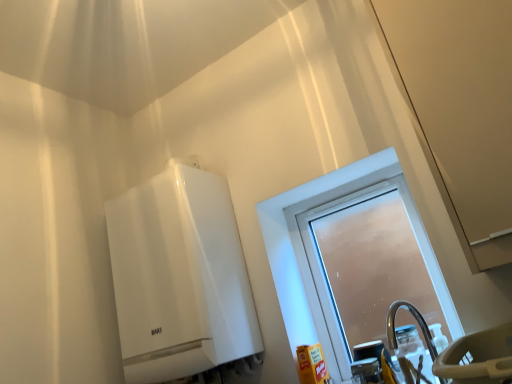
In order to click on transparent plastic screen door at upper right in this screenshot , I will do 461,108.

The image size is (512, 384). Describe the element at coordinates (461, 108) in the screenshot. I see `transparent plastic screen door at upper right` at that location.

Identify the location of white glossy water heater at upper left. Image resolution: width=512 pixels, height=384 pixels. (179, 277).

Is white glossy water heater at upper left bigger than frosted glass window at center?

Indeed, white glossy water heater at upper left has a larger size compared to frosted glass window at center.

Does point (229, 199) lie in front of point (340, 363)?

No, it is behind (340, 363).

In terms of height, does white glossy water heater at upper left look taller or shorter compared to frosted glass window at center?

Considering their sizes, white glossy water heater at upper left has more height than frosted glass window at center.

Considering the positions of objects white glossy water heater at upper left and frosted glass window at center in the image provided, who is behind, white glossy water heater at upper left or frosted glass window at center?

Positioned behind is frosted glass window at center.

Is transparent plastic screen door at upper right looking in the opposite direction of translucent plastic bottle at lower right?

No, transparent plastic screen door at upper right is not facing the opposite direction of translucent plastic bottle at lower right.

From a real-world perspective, is transparent plastic screen door at upper right under translucent plastic bottle at lower right?

No, from a real-world perspective, transparent plastic screen door at upper right is not under translucent plastic bottle at lower right.

Is point (465, 67) more distant than point (426, 362)?

No, (465, 67) is in front of (426, 362).

Would you say transparent plastic screen door at upper right is a long distance from translucent plastic bottle at lower right?

No, transparent plastic screen door at upper right is in close proximity to translucent plastic bottle at lower right.

Would you say frosted glass window at center contains translucent plastic bottle at lower right?

That's incorrect, translucent plastic bottle at lower right is not inside frosted glass window at center.

Considering the sizes of frosted glass window at center and translucent plastic bottle at lower right in the image, is frosted glass window at center wider or thinner than translucent plastic bottle at lower right?

Considering their sizes, frosted glass window at center looks slimmer than translucent plastic bottle at lower right.

Could you tell me if frosted glass window at center is facing translucent plastic bottle at lower right?

Yes, frosted glass window at center is facing translucent plastic bottle at lower right.

Does point (297, 243) appear closer or farther from the camera than point (423, 374)?

Point (297, 243) is positioned farther from the camera compared to point (423, 374).

Which is more to the left, transparent plastic screen door at upper right or frosted glass window at center?

From the viewer's perspective, frosted glass window at center appears more on the left side.

Considering the relative sizes of transparent plastic screen door at upper right and frosted glass window at center in the image provided, is transparent plastic screen door at upper right wider than frosted glass window at center?

Yes, transparent plastic screen door at upper right is wider than frosted glass window at center.

Considering the relative sizes of transparent plastic screen door at upper right and frosted glass window at center in the image provided, is transparent plastic screen door at upper right shorter than frosted glass window at center?

Incorrect, the height of transparent plastic screen door at upper right does not fall short of that of frosted glass window at center.

Is transparent plastic screen door at upper right in front of or behind frosted glass window at center in the image?

Visually, transparent plastic screen door at upper right is located in front of frosted glass window at center.

Is translucent plastic bottle at lower right surrounding frosted glass window at center?

No, frosted glass window at center is not surrounded by translucent plastic bottle at lower right.

From a real-world perspective, is translucent plastic bottle at lower right above or below frosted glass window at center?

In terms of real-world spatial position, translucent plastic bottle at lower right is below frosted glass window at center.

Considering the positions of objects translucent plastic bottle at lower right and frosted glass window at center in the image provided, who is in front, translucent plastic bottle at lower right or frosted glass window at center?

translucent plastic bottle at lower right.

Looking at this image, how many degrees apart are the facing directions of translucent plastic bottle at lower right and frosted glass window at center?

There is a 4.08-degree angle between the facing directions of translucent plastic bottle at lower right and frosted glass window at center.

Can you confirm if translucent plastic bottle at lower right is bigger than transparent plastic screen door at upper right?

No.

Can you tell me how much translucent plastic bottle at lower right and transparent plastic screen door at upper right differ in facing direction?

The facing directions of translucent plastic bottle at lower right and transparent plastic screen door at upper right are 4.46 degrees apart.

At what (x,y) coordinates should I click in order to perform the action: click on bottle below the transparent plastic screen door at upper right (from the image's perspective). Please return your answer as a coordinate pair (x, y). The width and height of the screenshot is (512, 384). Looking at the image, I should click on (413, 348).

Is translucent plastic bottle at lower right to the left of transparent plastic screen door at upper right from the viewer's perspective?

Yes.

Can you confirm if frosted glass window at center is positioned to the right of white glossy water heater at upper left?

Indeed, frosted glass window at center is positioned on the right side of white glossy water heater at upper left.

Based on their sizes in the image, would you say frosted glass window at center is bigger or smaller than white glossy water heater at upper left?

Clearly, frosted glass window at center is smaller in size than white glossy water heater at upper left.

Considering the relative positions of frosted glass window at center and white glossy water heater at upper left in the image provided, is frosted glass window at center in front of white glossy water heater at upper left?

No, frosted glass window at center is behind white glossy water heater at upper left.

Considering the positions of point (325, 324) and point (122, 227), is point (325, 324) closer or farther from the camera than point (122, 227)?

Point (325, 324) appears to be farther away from the viewer than point (122, 227).

Locate an element on the screen. The image size is (512, 384). window behind the white glossy water heater at upper left is located at coordinates (323, 270).

The height and width of the screenshot is (384, 512). Find the location of `screen door above the translucent plastic bottle at lower right (from the image's perspective)`. screen door above the translucent plastic bottle at lower right (from the image's perspective) is located at coordinates (461, 108).

From the image, which object appears to be farther from frosted glass window at center, transparent plastic screen door at upper right or white glossy water heater at upper left?

transparent plastic screen door at upper right is positioned further to the anchor frosted glass window at center.

Considering their positions, is white glossy water heater at upper left positioned closer to translucent plastic bottle at lower right than frosted glass window at center?

frosted glass window at center lies closer to translucent plastic bottle at lower right than the other object.

Which object lies further to the anchor point frosted glass window at center, translucent plastic bottle at lower right or transparent plastic screen door at upper right?

The object further to frosted glass window at center is transparent plastic screen door at upper right.

When comparing their distances from translucent plastic bottle at lower right, does transparent plastic screen door at upper right or white glossy water heater at upper left seem further?

transparent plastic screen door at upper right is positioned further to the anchor translucent plastic bottle at lower right.

Considering their positions, is translucent plastic bottle at lower right positioned further to white glossy water heater at upper left than frosted glass window at center?

translucent plastic bottle at lower right.

From the image, which object appears to be farther from frosted glass window at center, translucent plastic bottle at lower right or white glossy water heater at upper left?

white glossy water heater at upper left.

Based on their spatial positions, is frosted glass window at center or transparent plastic screen door at upper right closer to translucent plastic bottle at lower right?

frosted glass window at center is positioned closer to the anchor translucent plastic bottle at lower right.

Estimate the real-world distances between objects in this image. Which object is closer to transparent plastic screen door at upper right, translucent plastic bottle at lower right or white glossy water heater at upper left?

translucent plastic bottle at lower right is positioned closer to the anchor transparent plastic screen door at upper right.

Identify the location of window between transparent plastic screen door at upper right and translucent plastic bottle at lower right from top to bottom. Image resolution: width=512 pixels, height=384 pixels. (323, 270).

This screenshot has height=384, width=512. Find the location of `window located between white glossy water heater at upper left and transparent plastic screen door at upper right in the left-right direction`. window located between white glossy water heater at upper left and transparent plastic screen door at upper right in the left-right direction is located at coordinates (323, 270).

You are a GUI agent. You are given a task and a screenshot of the screen. Output one action in this format:
    pyautogui.click(x=<x>, y=<y>)
    Task: Click on the bottle situated between white glossy water heater at upper left and transparent plastic screen door at upper right from left to right
    The image size is (512, 384).
    Given the screenshot: What is the action you would take?
    pyautogui.click(x=413, y=348)

In order to click on window between white glossy water heater at upper left and translucent plastic bottle at lower right from left to right in this screenshot , I will do `click(323, 270)`.